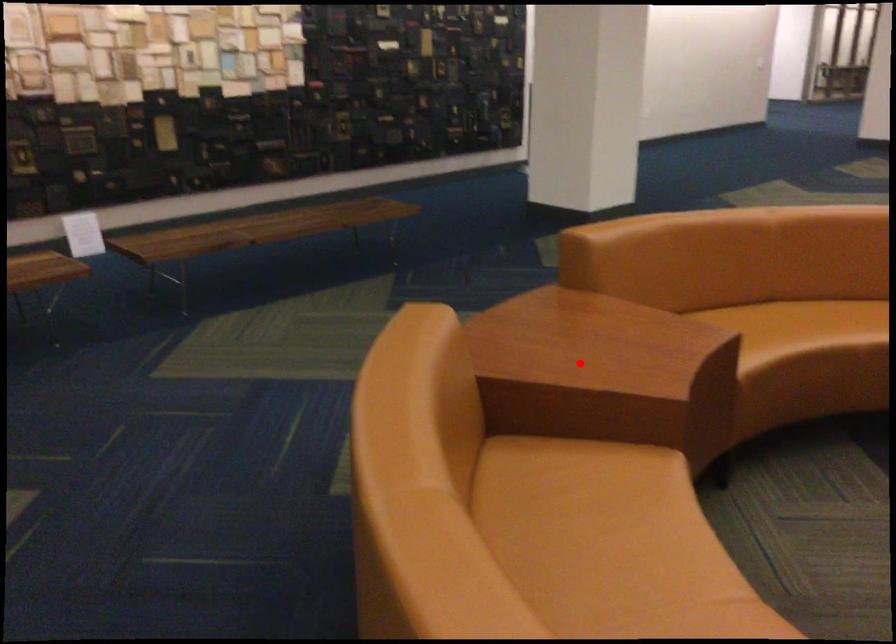
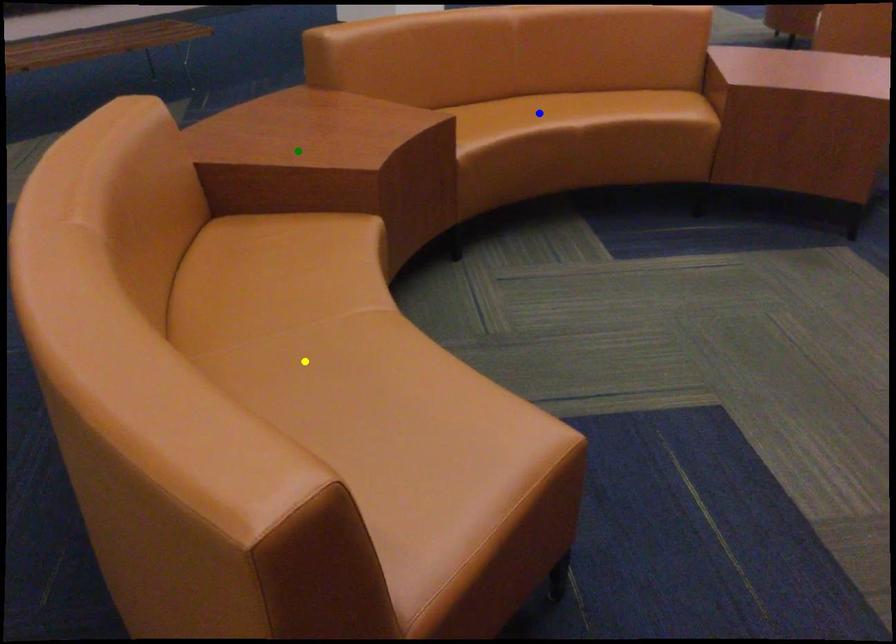
Question: I am providing you with two images of the same scene from different viewpoints. A red point is marked on the first image. You are given multiple points on the second image. Which spot in image 2 lines up with the point in image 1?

Choices:
 (A) blue point
 (B) yellow point
 (C) green point

Answer: (C)